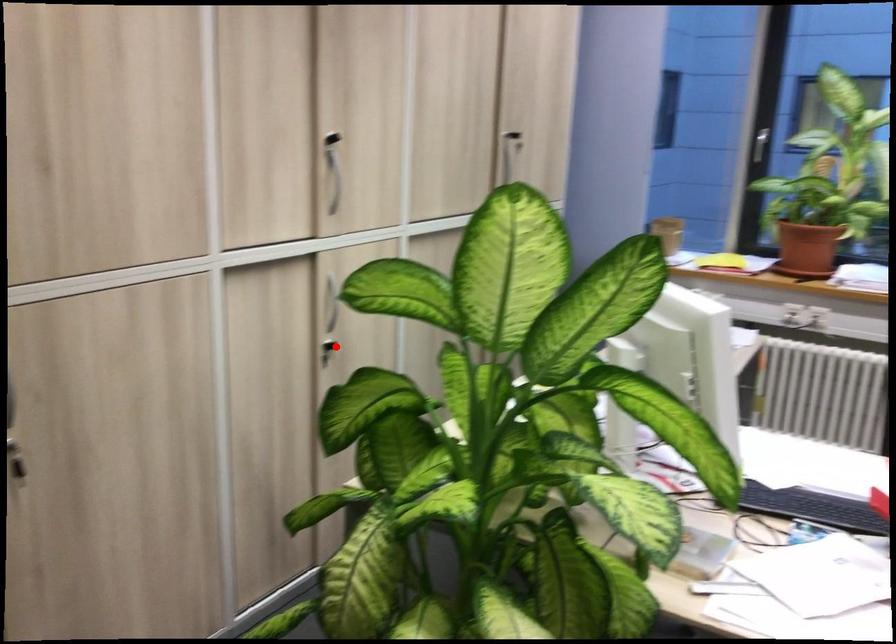
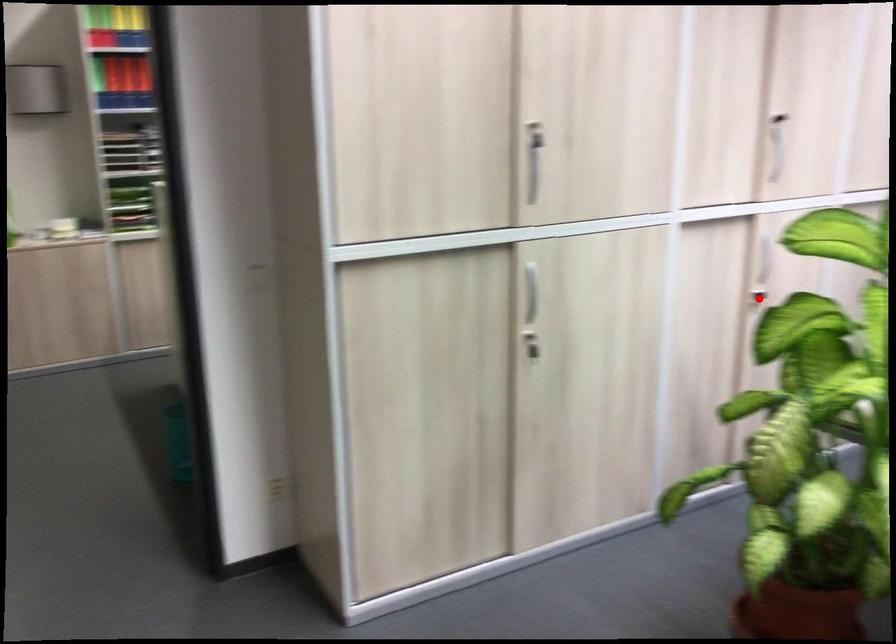
I am providing you with two images of the same scene from different viewpoints. A red point is marked on the first image and another point is marked on the second image. Does the point marked in image1 correspond to the same location as the one in image2?

Yes